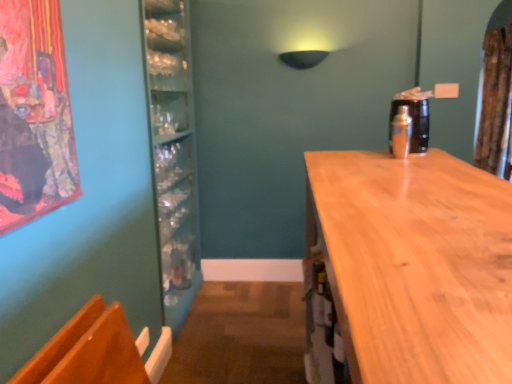
Question: Does light brown wood countertop at right come in front of brown textured curtain at upper right?

Choices:
 (A) no
 (B) yes

Answer: (B)

Question: Considering the relative sizes of light brown wood countertop at right and brown textured curtain at upper right in the image provided, is light brown wood countertop at right bigger than brown textured curtain at upper right?

Choices:
 (A) no
 (B) yes

Answer: (B)

Question: Does light brown wood countertop at right contain brown textured curtain at upper right?

Choices:
 (A) no
 (B) yes

Answer: (A)

Question: Is light brown wood countertop at right at the left side of brown textured curtain at upper right?

Choices:
 (A) no
 (B) yes

Answer: (B)

Question: Can you confirm if light brown wood countertop at right is smaller than brown textured curtain at upper right?

Choices:
 (A) yes
 (B) no

Answer: (B)

Question: Does light brown wood countertop at right have a lesser width compared to brown textured curtain at upper right?

Choices:
 (A) yes
 (B) no

Answer: (B)

Question: Is wooden armchair at lower left far from light brown wood countertop at right?

Choices:
 (A) yes
 (B) no

Answer: (B)

Question: From a real-world perspective, is wooden armchair at lower left on light brown wood countertop at right?

Choices:
 (A) no
 (B) yes

Answer: (B)

Question: Is wooden armchair at lower left looking in the opposite direction of light brown wood countertop at right?

Choices:
 (A) no
 (B) yes

Answer: (A)

Question: Is wooden armchair at lower left to the right of light brown wood countertop at right from the viewer's perspective?

Choices:
 (A) yes
 (B) no

Answer: (B)

Question: Considering the relative sizes of wooden armchair at lower left and light brown wood countertop at right in the image provided, is wooden armchair at lower left thinner than light brown wood countertop at right?

Choices:
 (A) no
 (B) yes

Answer: (B)

Question: Can you confirm if wooden armchair at lower left is taller than light brown wood countertop at right?

Choices:
 (A) yes
 (B) no

Answer: (B)

Question: Is shiny metallic shaker at right at the left side of light brown wood countertop at right?

Choices:
 (A) yes
 (B) no

Answer: (B)